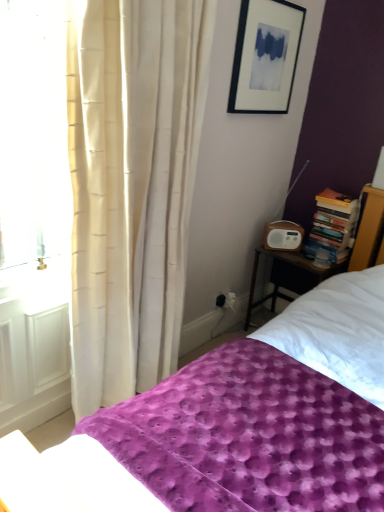
Question: From the image's perspective, is black matte picture frame at upper center above or below wooden nightstand at right?

Choices:
 (A) below
 (B) above

Answer: (B)

Question: Does point (266, 6) appear closer or farther from the camera than point (266, 254)?

Choices:
 (A) farther
 (B) closer

Answer: (B)

Question: Considering the real-world distances, which object is farthest from the hardcover books at right?

Choices:
 (A) wooden nightstand at right
 (B) purple textured blanket at lower center
 (C) black matte picture frame at upper center

Answer: (B)

Question: Which is farther from the hardcover books at right?

Choices:
 (A) black matte picture frame at upper center
 (B) purple textured blanket at lower center
 (C) wooden nightstand at right

Answer: (B)